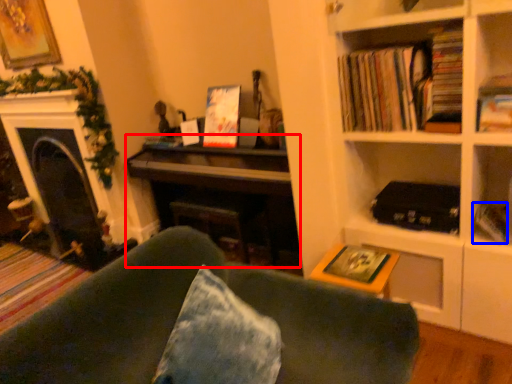
Question: Which object appears closest to the camera in this image, piano (highlighted by a red box) or paperback book (highlighted by a blue box)?

Choices:
 (A) piano
 (B) paperback book

Answer: (B)